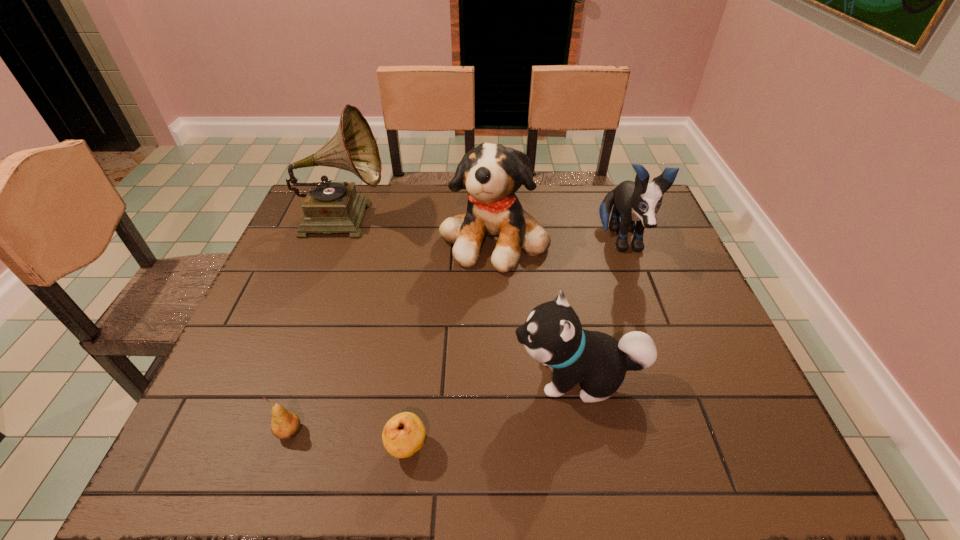
This screenshot has height=540, width=960. What are the coordinates of `vacant area situated 0.360m on the back of the right pear` in the screenshot? It's located at (425, 295).

Where is `record player at the far edge`? This screenshot has width=960, height=540. record player at the far edge is located at coordinates (329, 207).

Find the location of a particular element. The height and width of the screenshot is (540, 960). record player located at the left edge is located at coordinates (329, 207).

The width and height of the screenshot is (960, 540). In order to click on pear situated at the left edge in this screenshot , I will do `click(284, 425)`.

Where is `object located in the right edge section of the desktop`? object located in the right edge section of the desktop is located at coordinates (639, 200).

Find the location of a particular element. The width and height of the screenshot is (960, 540). object positioned at the far left corner is located at coordinates (329, 207).

Identify the location of object present at the near left corner. pyautogui.click(x=284, y=425).

Find the location of a particular element. object located at the far right corner is located at coordinates (639, 200).

You are a GUI agent. You are given a task and a screenshot of the screen. Output one action in this format:
    pyautogui.click(x=<x>, y=<y>)
    Task: Click on the vacant space at the far edge of the desktop
    The image size is (960, 540).
    Given the screenshot: What is the action you would take?
    pyautogui.click(x=396, y=187)

Where is `free space at the near edge of the desktop`? The height and width of the screenshot is (540, 960). free space at the near edge of the desktop is located at coordinates (314, 469).